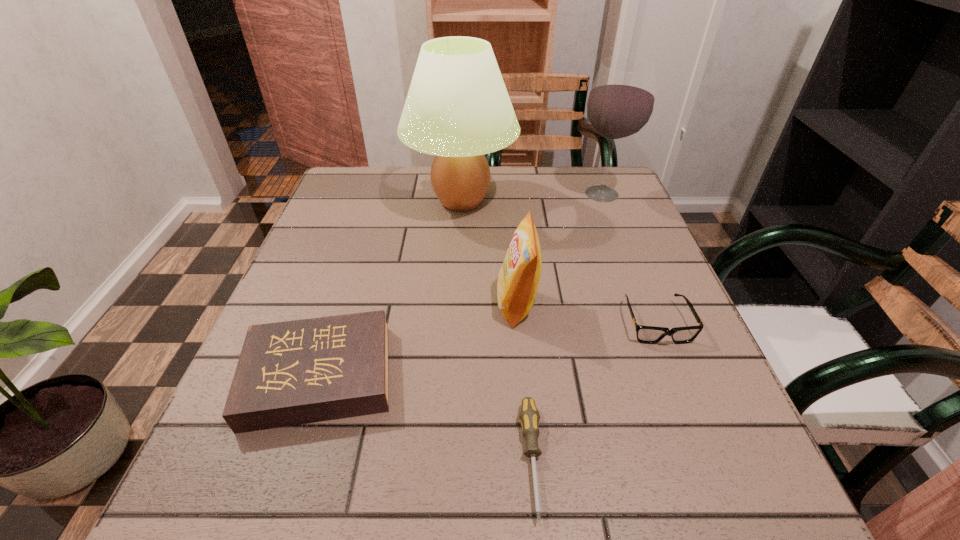
Find the location of a particular element. The width and height of the screenshot is (960, 540). lampshade is located at coordinates (457, 108).

Where is `alcohol`? This screenshot has width=960, height=540. alcohol is located at coordinates (620, 104).

You are a GUI agent. You are given a task and a screenshot of the screen. Output one action in this format:
    pyautogui.click(x=<x>, y=<y>)
    Task: Click on the crisp (potato chip)
    This screenshot has height=540, width=960.
    Given the screenshot: What is the action you would take?
    pyautogui.click(x=517, y=282)

Identify the location of hardback book. The height and width of the screenshot is (540, 960). (296, 372).

Image resolution: width=960 pixels, height=540 pixels. I want to click on sunglasses, so click(645, 334).

The height and width of the screenshot is (540, 960). In order to click on the shortest object in this screenshot , I will do `click(529, 416)`.

The image size is (960, 540). I want to click on vacant area situated on the shade of the lampshade, so click(x=611, y=200).

Where is `vacant area situated 0.050m on the left of the alcohol`? Image resolution: width=960 pixels, height=540 pixels. vacant area situated 0.050m on the left of the alcohol is located at coordinates (554, 194).

Identify the location of vacant position located on the front-facing side of the crisp (potato chip). (406, 305).

I want to click on vacant space located 0.240m on the front-facing side of the crisp (potato chip), so coord(376,305).